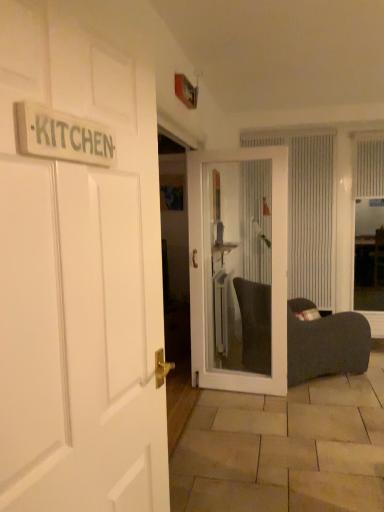
Question: From a real-world perspective, is white glass door at center, the 1th door positioned from the back, under white textured window screen at right?

Choices:
 (A) no
 (B) yes

Answer: (B)

Question: Considering the relative positions of white glass door at center, arranged as the 1th door when viewed from the right, and white textured window screen at right in the image provided, is white glass door at center, arranged as the 1th door when viewed from the right, behind white textured window screen at right?

Choices:
 (A) no
 (B) yes

Answer: (A)

Question: Does white glass door at center, arranged as the 1th door when viewed from the right, appear on the right side of white textured window screen at right?

Choices:
 (A) yes
 (B) no

Answer: (B)

Question: Is white textured window screen at right at the back of white glass door at center, arranged as the 1th door when viewed from the right?

Choices:
 (A) yes
 (B) no

Answer: (B)

Question: From a real-world perspective, is white glass door at center, the second door in the left-to-right sequence, located higher than white textured window screen at right?

Choices:
 (A) no
 (B) yes

Answer: (A)

Question: Considering the positions of white wooden door at left, arranged as the first door when viewed from the front, and white textured curtain at center, which is the first curtain in left-to-right order, in the image, is white wooden door at left, arranged as the first door when viewed from the front, bigger or smaller than white textured curtain at center, which is the first curtain in left-to-right order,?

Choices:
 (A) small
 (B) big

Answer: (A)

Question: Is white wooden door at left, the 2th door when ordered from right to left, taller or shorter than white textured curtain at center, placed as the second curtain when sorted from right to left?

Choices:
 (A) short
 (B) tall

Answer: (A)

Question: From a real-world perspective, is white wooden door at left, the second door from the back, positioned above or below white textured curtain at center, which is the first curtain in left-to-right order?

Choices:
 (A) above
 (B) below

Answer: (B)

Question: Is white wooden door at left, the 2th door when ordered from right to left, spatially inside white textured curtain at center, placed as the second curtain when sorted from right to left, or outside of it?

Choices:
 (A) outside
 (B) inside

Answer: (A)

Question: From the image's perspective, is white textured curtain at center, placed as the second curtain when sorted from right to left, positioned above or below wooden sign at upper left?

Choices:
 (A) below
 (B) above

Answer: (B)

Question: In the image, is white textured curtain at center, placed as the second curtain when sorted from right to left, on the left side or the right side of wooden sign at upper left?

Choices:
 (A) right
 (B) left

Answer: (A)

Question: Considering the positions of white textured curtain at center, placed as the second curtain when sorted from right to left, and wooden sign at upper left in the image, is white textured curtain at center, placed as the second curtain when sorted from right to left, wider or thinner than wooden sign at upper left?

Choices:
 (A) wide
 (B) thin

Answer: (A)

Question: Is point (307, 195) closer or farther from the camera than point (41, 153)?

Choices:
 (A) closer
 (B) farther

Answer: (B)

Question: In terms of height, does wooden sign at upper left look taller or shorter compared to white glass door at center, arranged as the 1th door when viewed from the right?

Choices:
 (A) tall
 (B) short

Answer: (B)

Question: In the image, is wooden sign at upper left positioned in front of or behind white glass door at center, the 1th door positioned from the back?

Choices:
 (A) behind
 (B) front

Answer: (B)